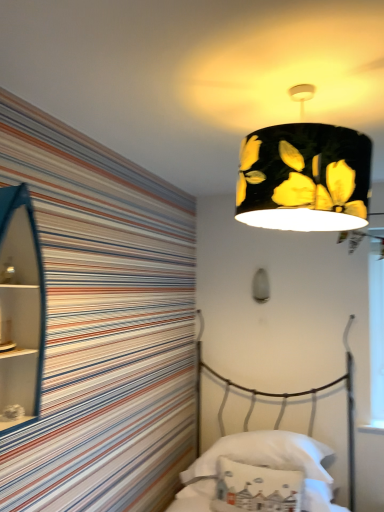
Question: Is black matte lampshade at upper center, which ranks as the second lamp in bottom-to-top order, taller or shorter than white fabric pillow at lower center, the second pillow viewed from the front?

Choices:
 (A) short
 (B) tall

Answer: (B)

Question: Is point (276, 159) closer or farther from the camera than point (208, 463)?

Choices:
 (A) farther
 (B) closer

Answer: (B)

Question: Considering the real-world distances, which object is farthest from the white fabric pillow at lower center, which is the 2th pillow from back to front?

Choices:
 (A) white fabric pillow at lower center, acting as the first pillow starting from the back
 (B) satin white lampshade at upper center, positioned as the 1th lamp in back-to-front order
 (C) black matte lampshade at upper center, arranged as the 1th lamp when viewed from the front
 (D) transparent plastic window screen at right
 (E) blue glossy cabinet at left

Answer: (C)

Question: Estimate the real-world distances between objects in this image. Which object is closer to the black matte lampshade at upper center, arranged as the 1th lamp when viewed from the front?

Choices:
 (A) satin white lampshade at upper center, the 2th lamp when ordered from front to back
 (B) transparent plastic window screen at right
 (C) blue glossy cabinet at left
 (D) white fabric pillow at lower center, which is the 2th pillow from back to front
 (E) white fabric pillow at lower center, the second pillow viewed from the front

Answer: (C)